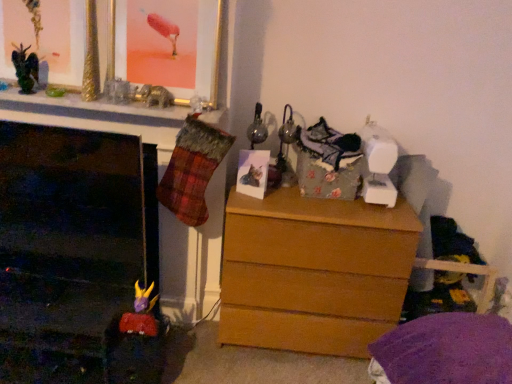
Where is `unoccupied area in front of matte paper photo at center, the 2th picture frame viewed from the top`? The height and width of the screenshot is (384, 512). unoccupied area in front of matte paper photo at center, the 2th picture frame viewed from the top is located at coordinates (250, 199).